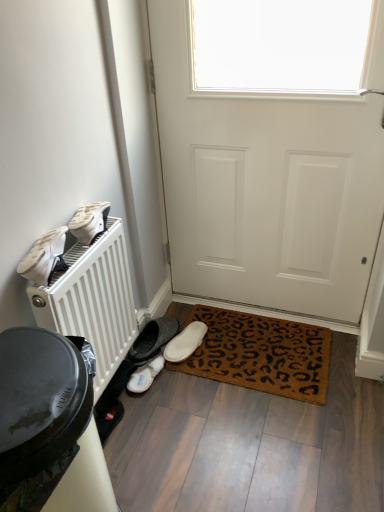
The height and width of the screenshot is (512, 384). Find the location of `free space above black plastic trash can at lower left (from a real-world perspective)`. free space above black plastic trash can at lower left (from a real-world perspective) is located at coordinates click(x=30, y=372).